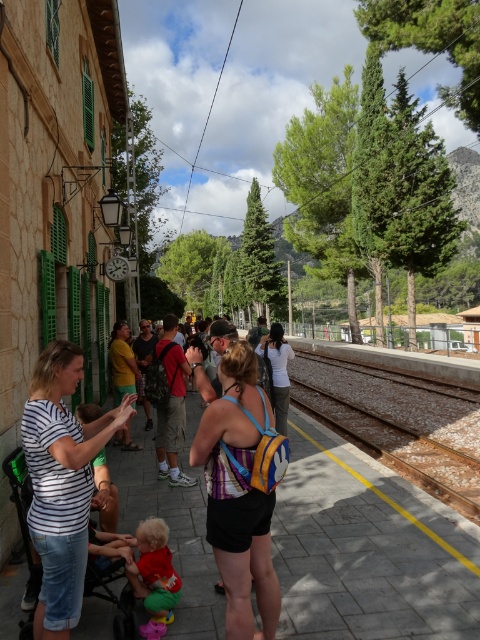
Question: Is the position of smooth concrete train track at center less distant than that of white cotton shirt at center?

Choices:
 (A) no
 (B) yes

Answer: (A)

Question: Estimate the real-world distances between objects in this image. Which object is closer to the yellow cotton shirt at center?

Choices:
 (A) multicolored fabric backpack at center
 (B) smooth concrete train track at center
 (C) camouflage shorts at center
 (D) striped cotton shirt at center

Answer: (C)

Question: Can you confirm if striped cotton shirt at center is positioned below red-clothed backpack at center?

Choices:
 (A) no
 (B) yes

Answer: (A)

Question: Does smooth concrete train track at center appear over red-clothed backpack at center?

Choices:
 (A) no
 (B) yes

Answer: (A)

Question: Which of the following is the farthest from the observer?

Choices:
 (A) striped cotton shirt at center
 (B) smooth concrete train track at center
 (C) camouflage shorts at center

Answer: (C)

Question: Which point is farther to the camera?

Choices:
 (A) white cotton shirt at center
 (B) yellow cotton shirt at center
 (C) red-clothed backpack at center

Answer: (B)